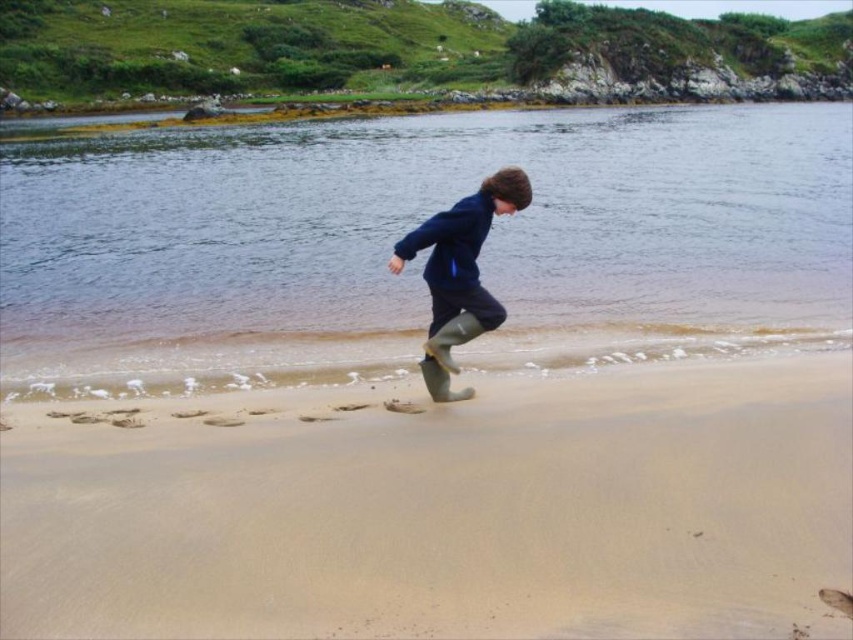
Question: Can you confirm if smooth sand at lower center is positioned below rubber boots at center?

Choices:
 (A) no
 (B) yes

Answer: (B)

Question: Among these points, which one is nearest to the camera?

Choices:
 (A) (328, 474)
 (B) (433, 246)

Answer: (A)

Question: Is smooth sand at lower center above clear water at center?

Choices:
 (A) no
 (B) yes

Answer: (A)

Question: Which object appears farthest from the camera in this image?

Choices:
 (A) smooth sand at lower center
 (B) rubber boots at center
 (C) clear water at center

Answer: (C)

Question: Can you confirm if smooth sand at lower center is positioned above rubber boots at center?

Choices:
 (A) no
 (B) yes

Answer: (A)

Question: Which of the following is the closest to the observer?

Choices:
 (A) clear water at center
 (B) rubber boots at center
 (C) smooth sand at lower center

Answer: (C)